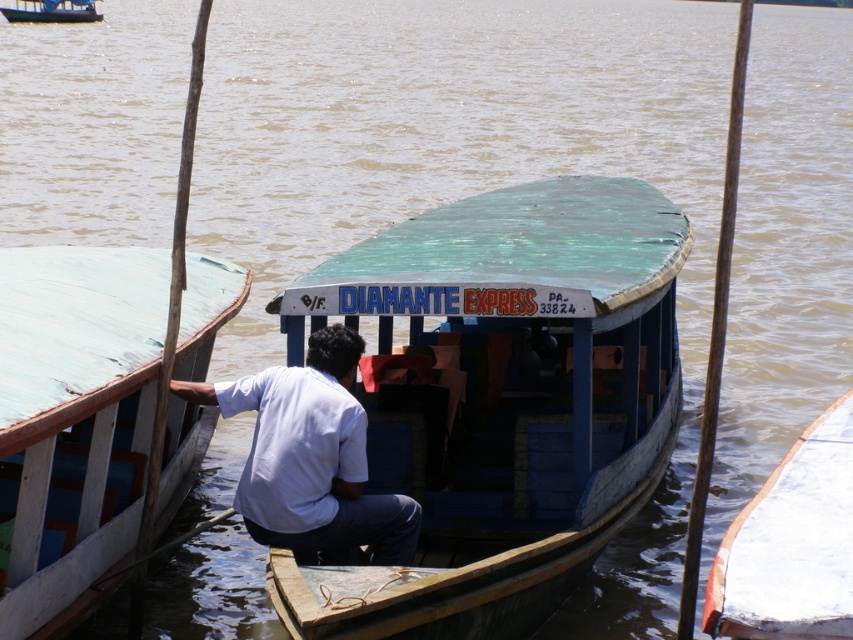
You are a photographer planning to take a photo of the wooden boat at left and the green matte boat at center from the shore. Which boat should you focus on first if you want to capture the tallest vessel in the scene?

The wooden boat at left is much taller than the green matte boat at center, so you should focus on the wooden boat at left first to capture the tallest vessel in the scene.

You are standing on the wooden boat at left and want to reach the other boat 8.31 meters away. If your swimming ability allows you to swim 10 meters in 2 minutes, how long will it take you to reach the other boat?

→ The distance between the wooden boat at left and the other boat is 8.31 meters. Since you can swim 10 meters in 2 minutes, swimming 8.31 meters would take approximately 1.66 minutes, which is about 1 minute and 40 seconds.